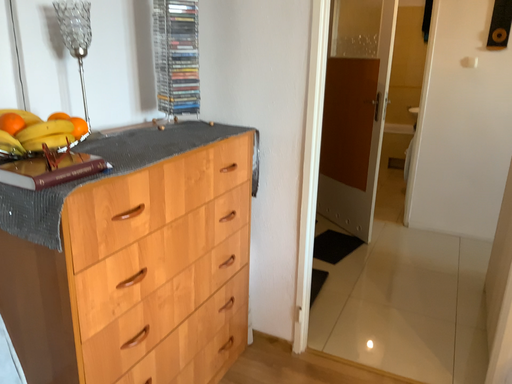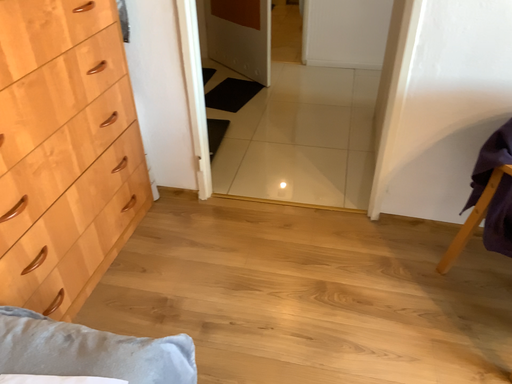
Question: How did the camera likely rotate when shooting the video?

Choices:
 (A) rotated left
 (B) rotated right

Answer: (B)